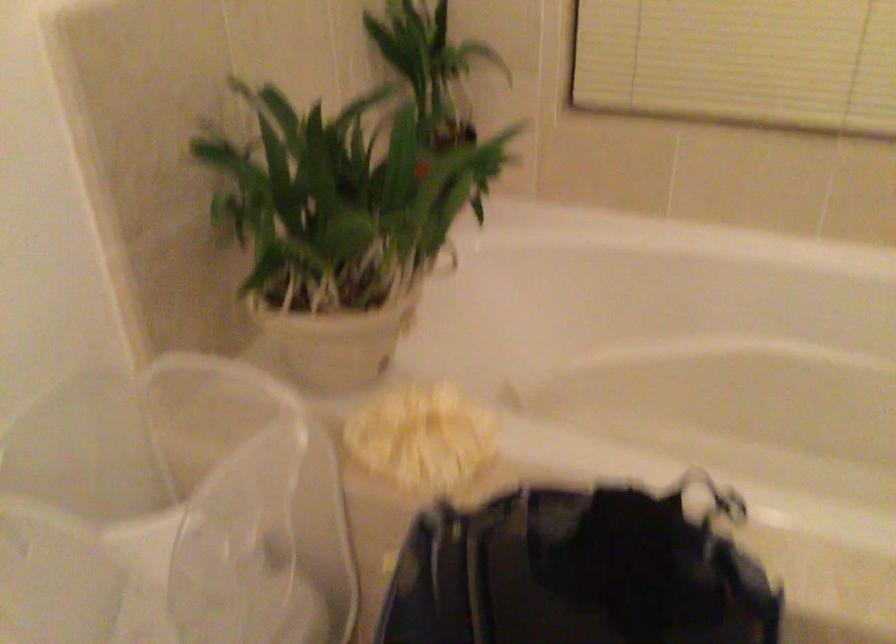
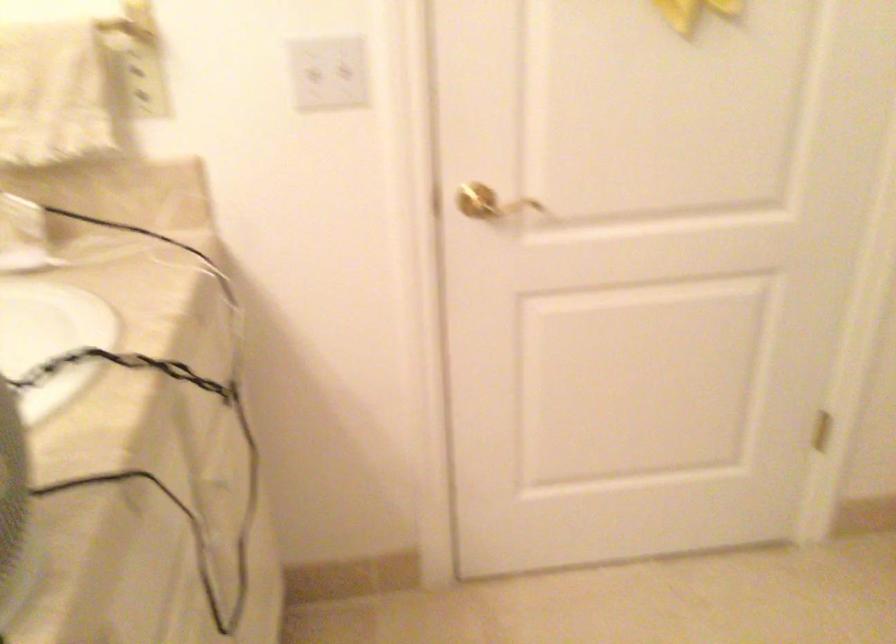
Question: The images are taken continuously from a first-person perspective. In which direction is your viewpoint rotating?

Choices:
 (A) Left
 (B) Right
 (C) Up
 (D) Down

Answer: (A)